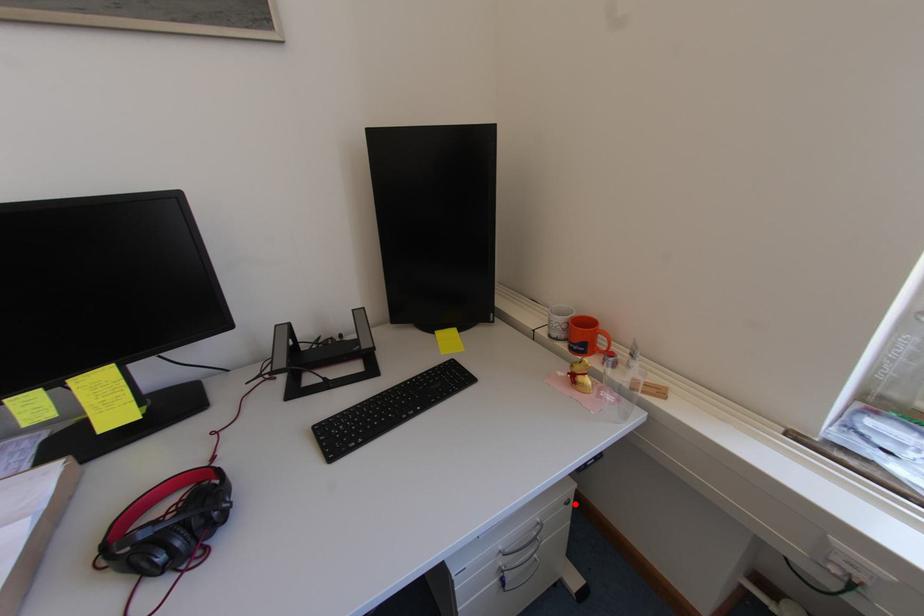
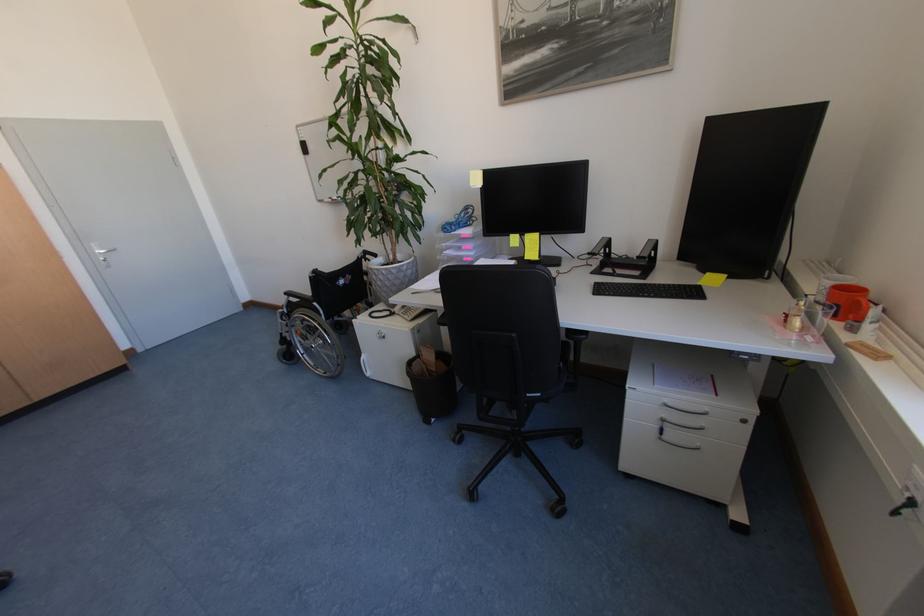
Find the pixel in the second image that matches the highlighted location in the first image.

(751, 422)